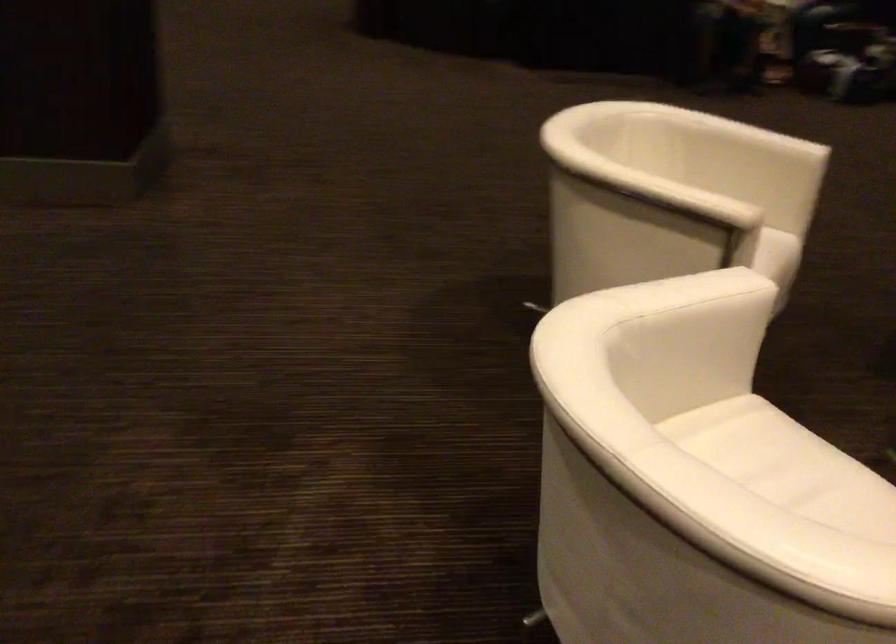
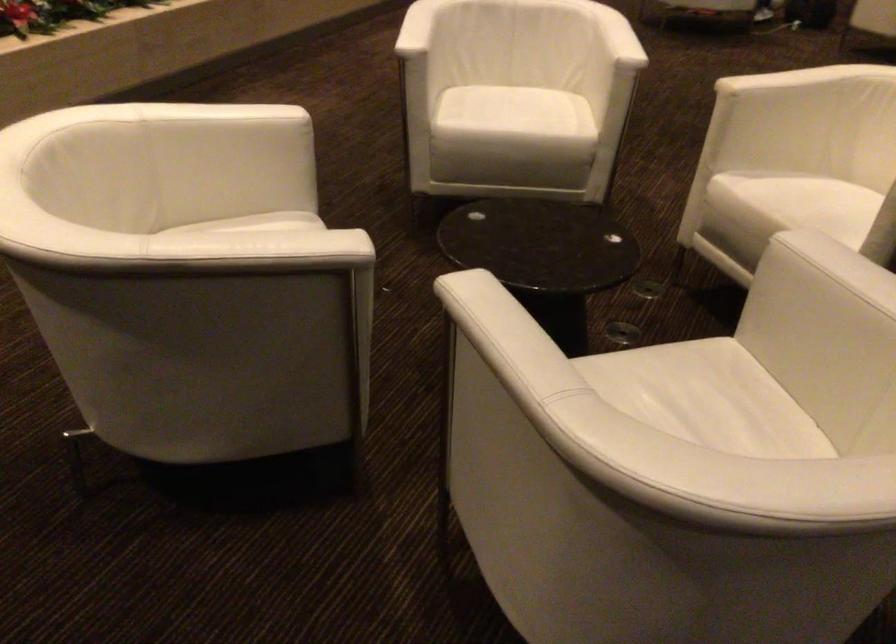
The point at (719, 281) is marked in the first image. Where is the corresponding point in the second image?

(617, 37)